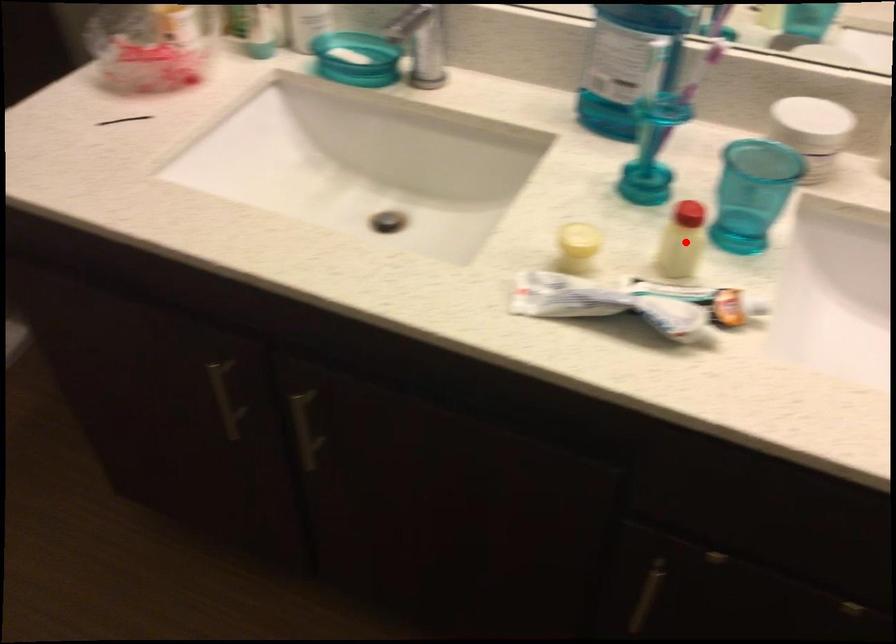
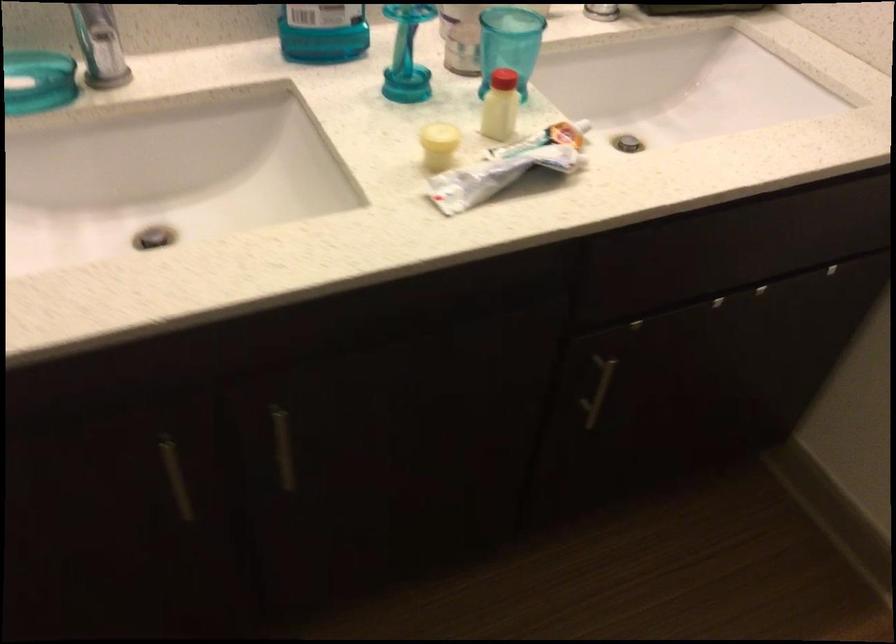
Question: I am providing you with two images of the same scene from different viewpoints. Image1 has a red point marked. In image2, the corresponding 3D location appears at what relative position? Reply with the corresponding letter.

Choices:
 (A) Closer
 (B) Farther

Answer: (B)